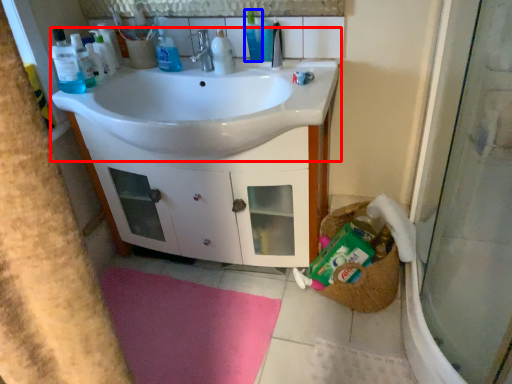
Question: Among these objects, which one is farthest to the camera, sink (highlighted by a red box) or toiletry (highlighted by a blue box)?

Choices:
 (A) sink
 (B) toiletry

Answer: (B)